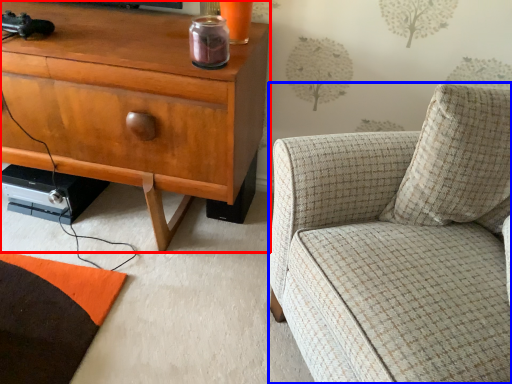
Question: Which object appears closest to the camera in this image, cabinetry (highlighted by a red box) or chair (highlighted by a blue box)?

Choices:
 (A) cabinetry
 (B) chair

Answer: (B)